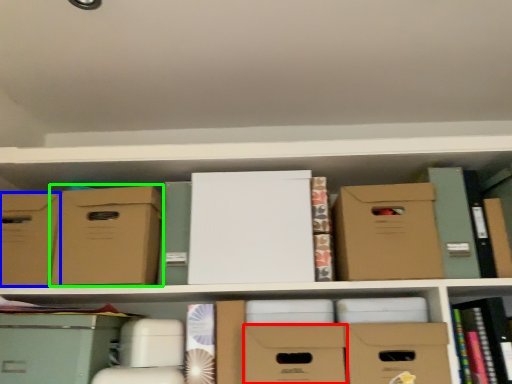
Question: Estimate the real-world distances between objects in this image. Which object is farther from storage box (highlighted by a red box), storage box (highlighted by a blue box) or cardboard box (highlighted by a green box)?

Choices:
 (A) storage box
 (B) cardboard box

Answer: (A)